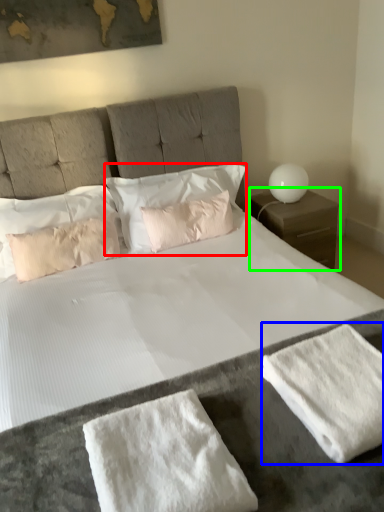
Question: Considering the real-world distances, which object is farthest from pillow (highlighted by a red box)? bath towel (highlighted by a blue box) or nightstand (highlighted by a green box)?

Choices:
 (A) bath towel
 (B) nightstand

Answer: (A)